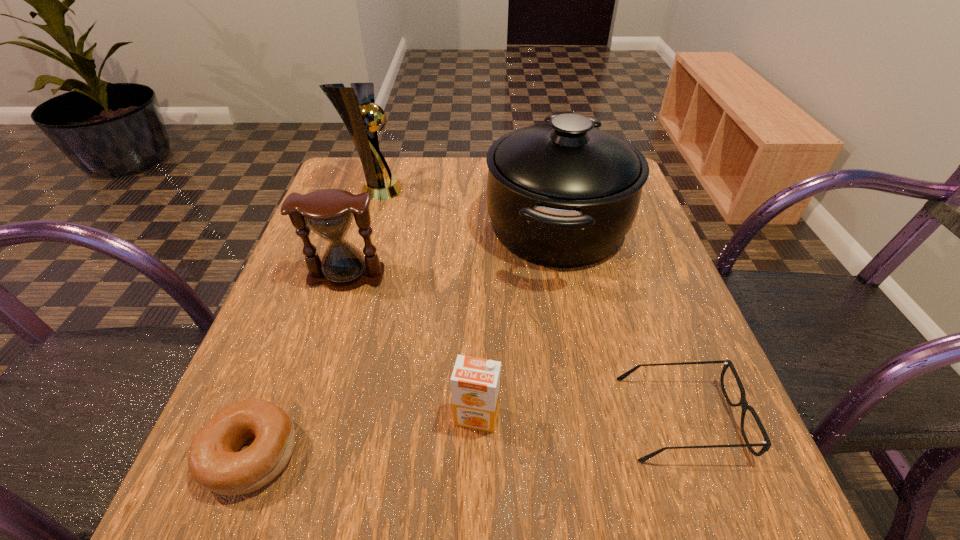
This screenshot has width=960, height=540. Identify the location of vacant region between the bagel and the award. (313, 322).

At what (x,y) coordinates should I click in order to perform the action: click on vacant space in between the second tallest object and the award. Please return your answer as a coordinate pair (x, y). The image size is (960, 540). Looking at the image, I should click on [x=466, y=207].

Locate an element on the screen. The height and width of the screenshot is (540, 960). empty space between the third shortest object and the spectacles is located at coordinates [x=579, y=417].

At what (x,y) coordinates should I click in order to perform the action: click on free space between the hourglass and the orange juice. Please return your answer as a coordinate pair (x, y). The image size is (960, 540). Looking at the image, I should click on (412, 346).

The width and height of the screenshot is (960, 540). Find the location of `object that is the closest to the bagel`. object that is the closest to the bagel is located at coordinates (475, 382).

Locate which object is the fifth closest to the fourth tallest object. Please provide its 2D coordinates. Your answer should be formatted as a tuple, i.e. [(x, y)], where the tuple contains the x and y coordinates of a point satisfying the conditions above.

[(356, 106)]

At what (x,y) coordinates should I click in order to perform the action: click on free space that satisfies the following two spatial constraints: 1. at the front of the award, where the globe is visible; 2. on the back side of the orange juice. Please return your answer as a coordinate pair (x, y). Looking at the image, I should click on (303, 416).

Locate an element on the screen. free space that satisfies the following two spatial constraints: 1. at the front of the award, where the globe is visible; 2. on the front side of the bagel is located at coordinates (292, 454).

The image size is (960, 540). In order to click on free point that satisfies the following two spatial constraints: 1. on the back side of the saucepan; 2. on the left side of the bagel in this screenshot , I will do `click(338, 226)`.

You are a GUI agent. You are given a task and a screenshot of the screen. Output one action in this format:
    pyautogui.click(x=<x>, y=<y>)
    Task: Click on the vacant region that satisfies the following two spatial constraints: 1. with the lenses facing outward on the spectacles; 2. on the front side of the bagel
    Image resolution: width=960 pixels, height=540 pixels.
    Given the screenshot: What is the action you would take?
    pyautogui.click(x=693, y=454)